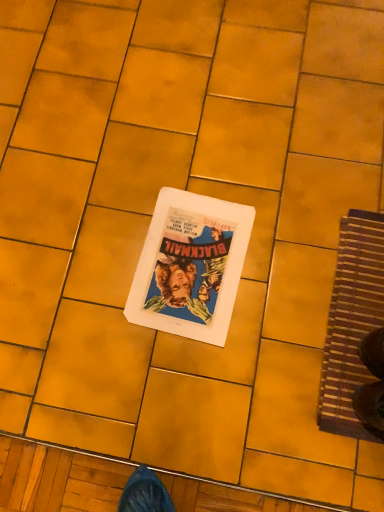
Question: Considering the relative sizes of brown woven mat at right and white paper at center in the image provided, is brown woven mat at right shorter than white paper at center?

Choices:
 (A) no
 (B) yes

Answer: (A)

Question: Considering the relative positions of brown woven mat at right and white paper at center in the image provided, is brown woven mat at right behind white paper at center?

Choices:
 (A) no
 (B) yes

Answer: (A)

Question: Does brown woven mat at right come in front of white paper at center?

Choices:
 (A) yes
 (B) no

Answer: (A)

Question: Is brown woven mat at right taller than white paper at center?

Choices:
 (A) yes
 (B) no

Answer: (A)

Question: Is brown woven mat at right positioned beyond the bounds of white paper at center?

Choices:
 (A) no
 (B) yes

Answer: (B)

Question: Does brown woven mat at right touch white paper at center?

Choices:
 (A) yes
 (B) no

Answer: (B)

Question: From a real-world perspective, is white paper at center physically above brown woven mat at right?

Choices:
 (A) no
 (B) yes

Answer: (B)

Question: From the image's perspective, is white paper at center located above brown woven mat at right?

Choices:
 (A) yes
 (B) no

Answer: (A)

Question: Can you confirm if white paper at center is bigger than brown woven mat at right?

Choices:
 (A) no
 (B) yes

Answer: (A)

Question: Considering the relative positions of white paper at center and brown woven mat at right in the image provided, is white paper at center in front of brown woven mat at right?

Choices:
 (A) no
 (B) yes

Answer: (A)

Question: Can you confirm if white paper at center is thinner than brown woven mat at right?

Choices:
 (A) yes
 (B) no

Answer: (A)

Question: Considering the relative positions of white paper at center and brown woven mat at right in the image provided, is white paper at center to the left of brown woven mat at right from the viewer's perspective?

Choices:
 (A) yes
 (B) no

Answer: (A)

Question: Is point (357, 236) positioned closer to the camera than point (200, 322)?

Choices:
 (A) closer
 (B) farther

Answer: (B)